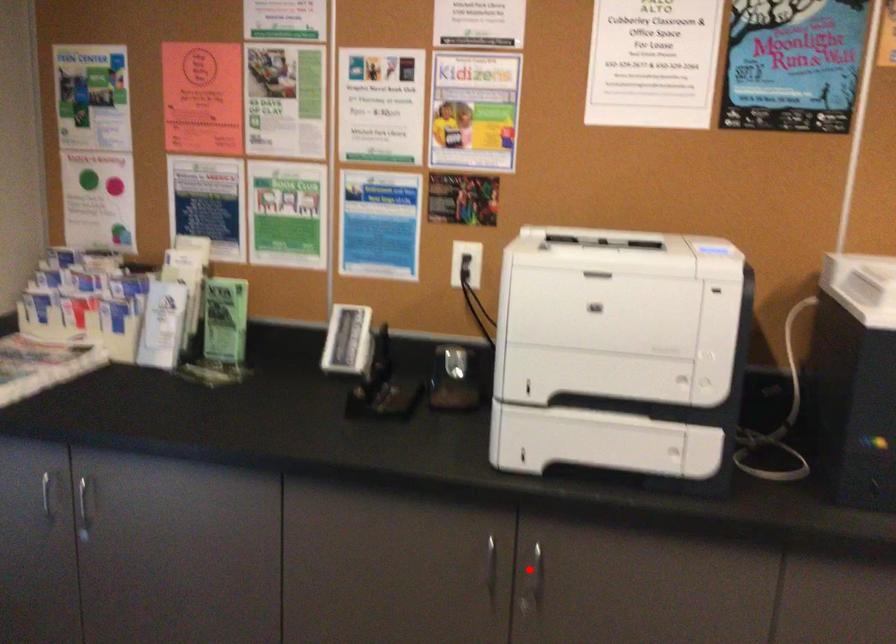
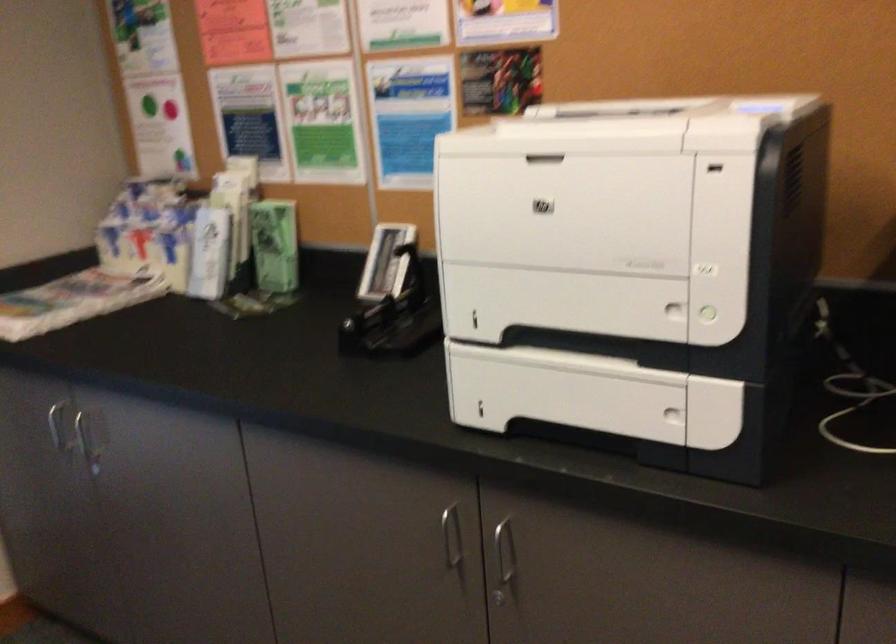
Locate, in the second image, the point that corresponds to the highlighted location in the first image.

(504, 559)